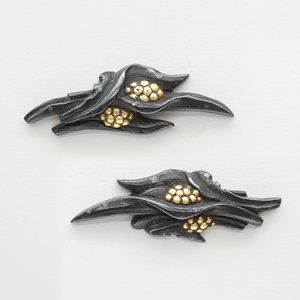
Identify the location of space to left of figurines. (69, 223), (21, 119).